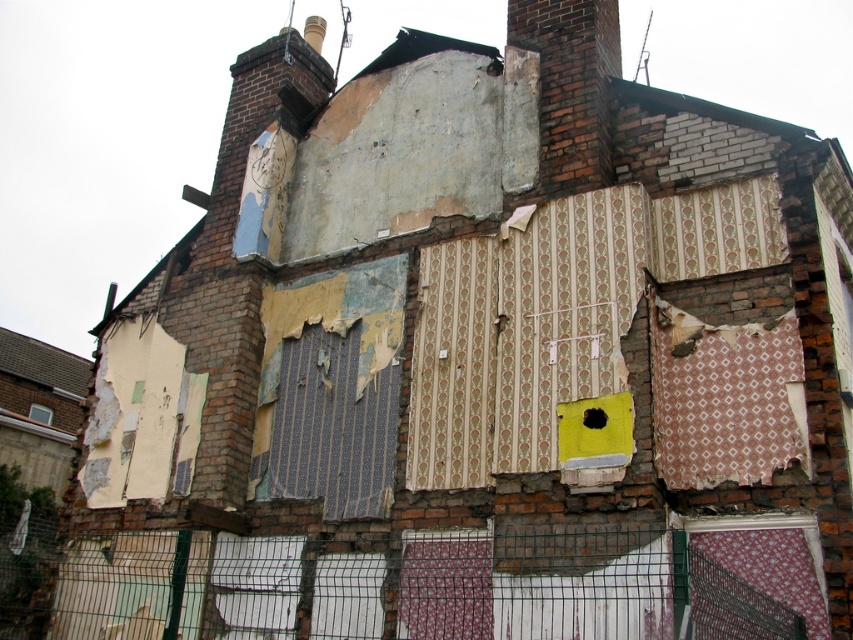
Is point (253, 538) less distant than point (599, 412)?

No, (253, 538) is further to viewer.

Between point (480, 563) and point (590, 424), which one is positioned in front?

Point (590, 424) is in front.

This screenshot has height=640, width=853. What do you see at coordinates (477, 589) in the screenshot?
I see `wire mesh fence at lower center` at bounding box center [477, 589].

You are a GUI agent. You are given a task and a screenshot of the screen. Output one action in this format:
    pyautogui.click(x=<x>, y=<y>)
    Task: Click on the wire mesh fence at lower center
    
    Given the screenshot: What is the action you would take?
    pyautogui.click(x=477, y=589)